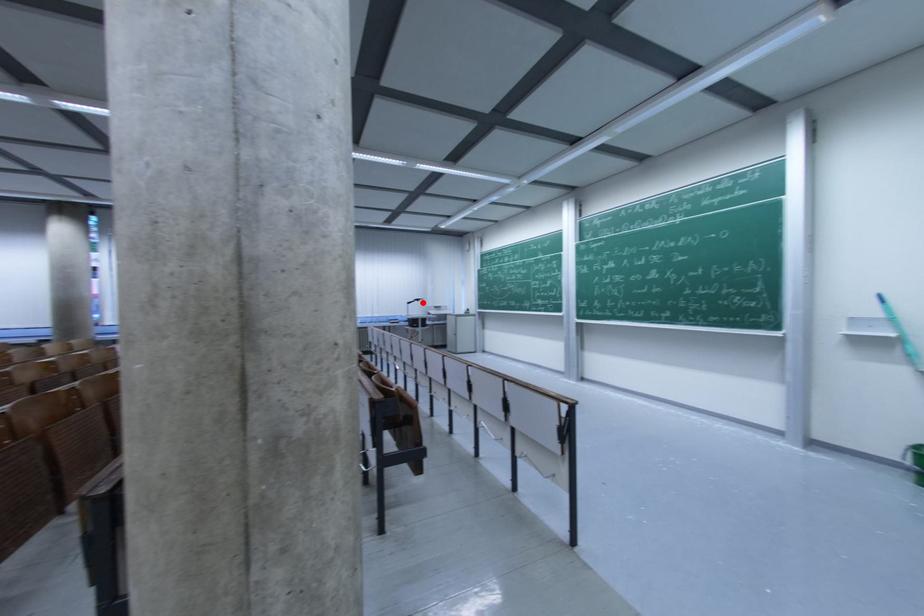
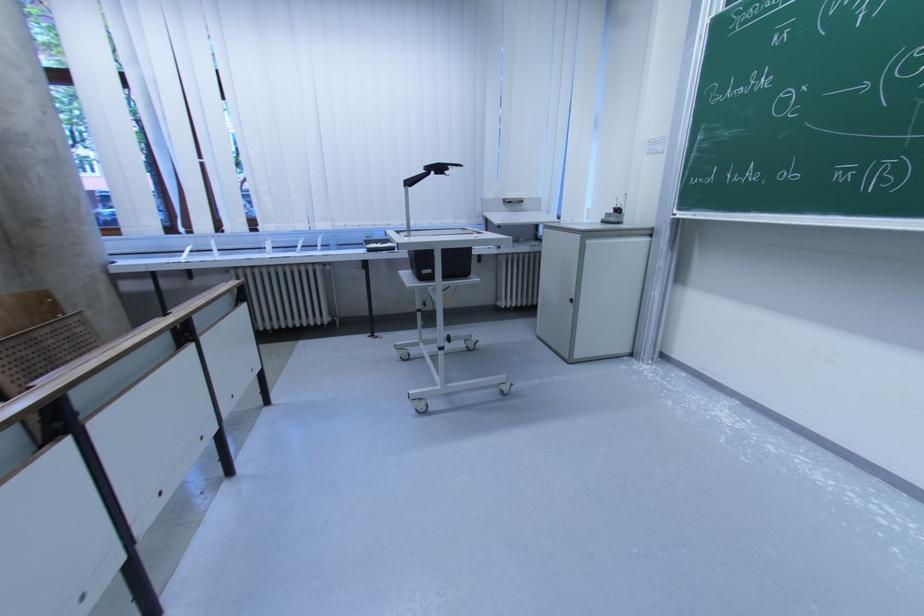
Question: I am providing you with two images of the same scene from different viewpoints. A red point is marked on the first image. At the location where the point appears in image 1, is it still visible in image 2?

Choices:
 (A) Yes
 (B) No

Answer: (A)